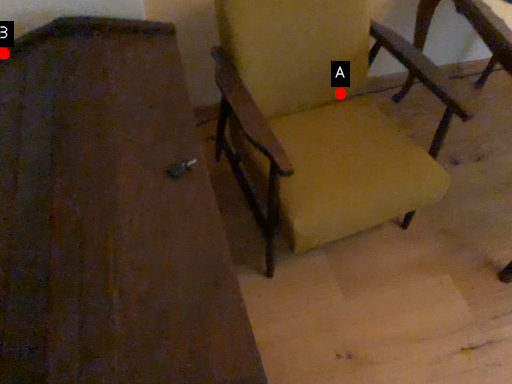
Question: Two points are circled on the image, labeled by A and B beside each circle. Among these points, which one is farthest from the camera?

Choices:
 (A) A is further
 (B) B is further

Answer: (A)